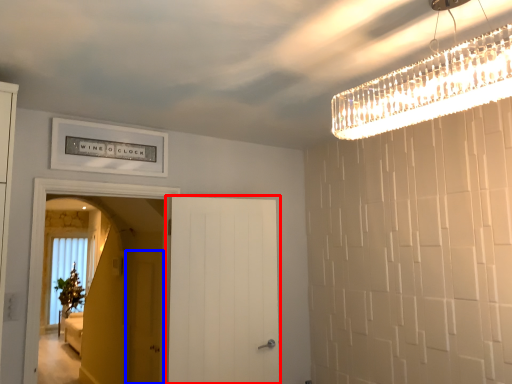
Question: Which of the following is the farthest to the observer, door (highlighted by a red box) or screen door (highlighted by a blue box)?

Choices:
 (A) door
 (B) screen door

Answer: (B)